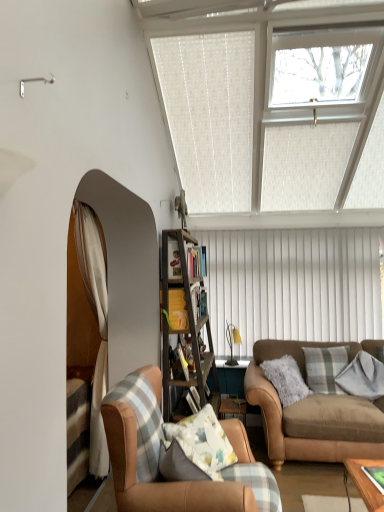
Question: Can you confirm if yellow fabric at center, which is counted as the third shelf, starting from the back, is positioned to the right of brown leather couch at lower right?

Choices:
 (A) yes
 (B) no

Answer: (B)

Question: Is the depth of yellow fabric at center, which is counted as the third shelf, starting from the back, greater than that of brown leather couch at lower right?

Choices:
 (A) no
 (B) yes

Answer: (B)

Question: Does yellow fabric at center, which is counted as the third shelf, starting from the back, have a larger size compared to brown leather couch at lower right?

Choices:
 (A) no
 (B) yes

Answer: (A)

Question: Is yellow fabric at center, which is the first shelf from front to back, positioned with its back to brown leather couch at lower right?

Choices:
 (A) no
 (B) yes

Answer: (A)

Question: Does yellow fabric at center, which is counted as the third shelf, starting from the back, have a greater height compared to brown leather couch at lower right?

Choices:
 (A) no
 (B) yes

Answer: (A)

Question: In terms of height, does leather armchair at lower left look taller or shorter compared to yellow fabric at center, which is the first shelf from front to back?

Choices:
 (A) tall
 (B) short

Answer: (A)

Question: Considering the positions of leather armchair at lower left and yellow fabric at center, which is the first shelf from front to back, in the image, is leather armchair at lower left bigger or smaller than yellow fabric at center, which is the first shelf from front to back,?

Choices:
 (A) big
 (B) small

Answer: (A)

Question: Relative to yellow fabric at center, which is the first shelf from front to back, is leather armchair at lower left in front or behind?

Choices:
 (A) behind
 (B) front

Answer: (B)

Question: Choose the correct answer: Is leather armchair at lower left inside yellow fabric at center, which is counted as the third shelf, starting from the back, or outside it?

Choices:
 (A) inside
 (B) outside

Answer: (B)

Question: From a real-world perspective, is wooden bookshelf at center, which is counted as the 2th shelf, starting from the front, above or below yellow fabric at center, which is counted as the third shelf, starting from the back?

Choices:
 (A) above
 (B) below

Answer: (B)

Question: Considering the positions of wooden bookshelf at center, which is the second shelf from back to front, and yellow fabric at center, which is counted as the third shelf, starting from the back, in the image, is wooden bookshelf at center, which is the second shelf from back to front, wider or thinner than yellow fabric at center, which is counted as the third shelf, starting from the back,?

Choices:
 (A) wide
 (B) thin

Answer: (B)

Question: Is point (200, 291) closer or farther from the camera than point (180, 326)?

Choices:
 (A) farther
 (B) closer

Answer: (A)

Question: From the image's perspective, relative to yellow fabric at center, which is the first shelf from front to back, is wooden bookshelf at center, which is counted as the 2th shelf, starting from the front, above or below?

Choices:
 (A) above
 (B) below

Answer: (B)

Question: Does point (334, 99) appear closer or farther from the camera than point (160, 297)?

Choices:
 (A) farther
 (B) closer

Answer: (A)

Question: Considering the positions of clear glass window at upper center and yellow fabric at center, which is counted as the third shelf, starting from the back, in the image, is clear glass window at upper center bigger or smaller than yellow fabric at center, which is counted as the third shelf, starting from the back,?

Choices:
 (A) small
 (B) big

Answer: (B)